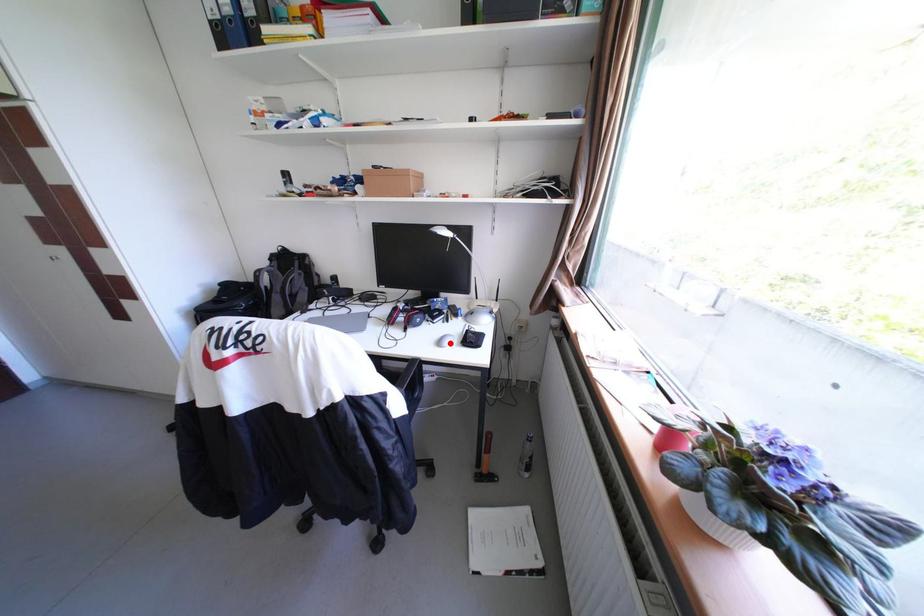
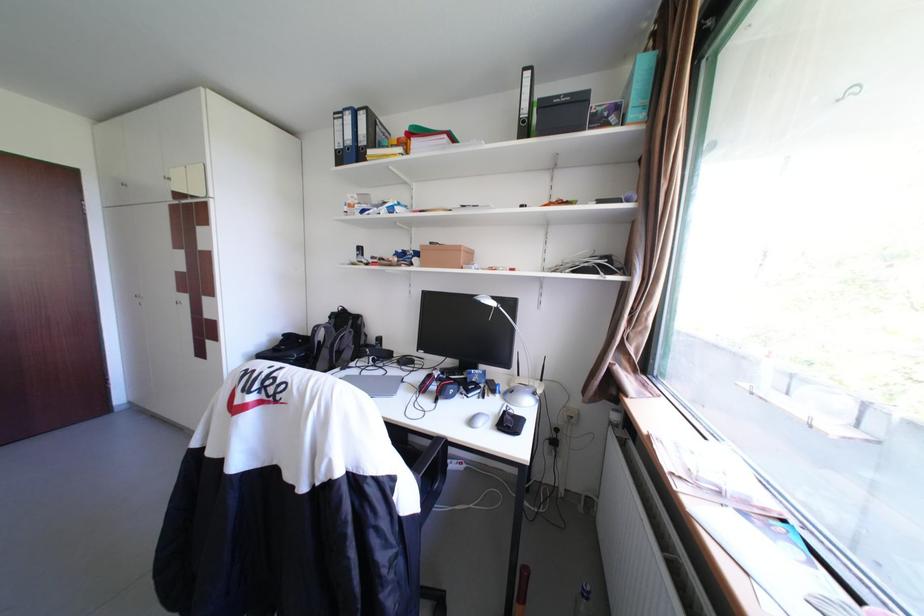
Question: I am providing you with two images of the same scene from different viewpoints. A red point is marked on the first image. At the location where the point appears in image 1, is it still visible in image 2?

Choices:
 (A) Yes
 (B) No

Answer: (A)